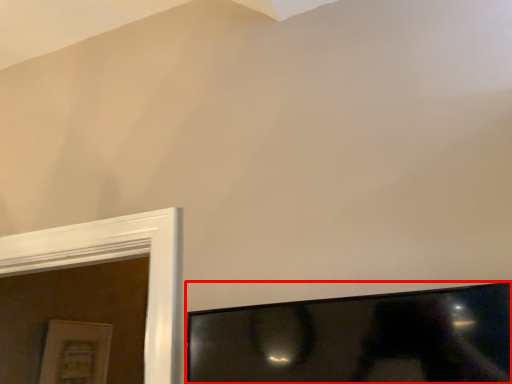
Question: From the image's perspective, what is the correct spatial relationship of television (annotated by the red box) in relation to picture frame?

Choices:
 (A) above
 (B) below

Answer: (A)